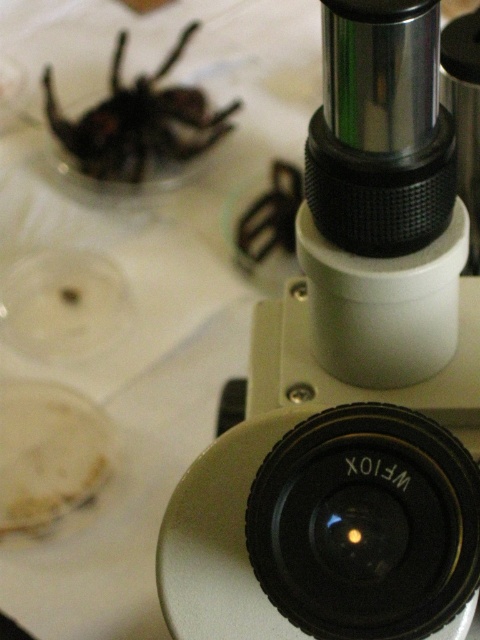
Question: Can you confirm if black plastic microscope at upper right is positioned above shiny black spider at upper left?

Choices:
 (A) no
 (B) yes

Answer: (A)

Question: Is black plastic microscope at upper right below shiny black spider at upper left?

Choices:
 (A) yes
 (B) no

Answer: (A)

Question: Which is farther from the black plastic microscope at upper right?

Choices:
 (A) shiny black spider at upper left
 (B) black plastic lens at center

Answer: (A)

Question: Which of the following is the closest to the observer?

Choices:
 (A) (130, 93)
 (B) (453, 477)

Answer: (B)

Question: Among these objects, which one is nearest to the camera?

Choices:
 (A) black plastic microscope at upper right
 (B) shiny black spider at upper left
 (C) black plastic lens at center

Answer: (C)

Question: Does black plastic microscope at upper right appear on the left side of shiny black spider at upper left?

Choices:
 (A) no
 (B) yes

Answer: (A)